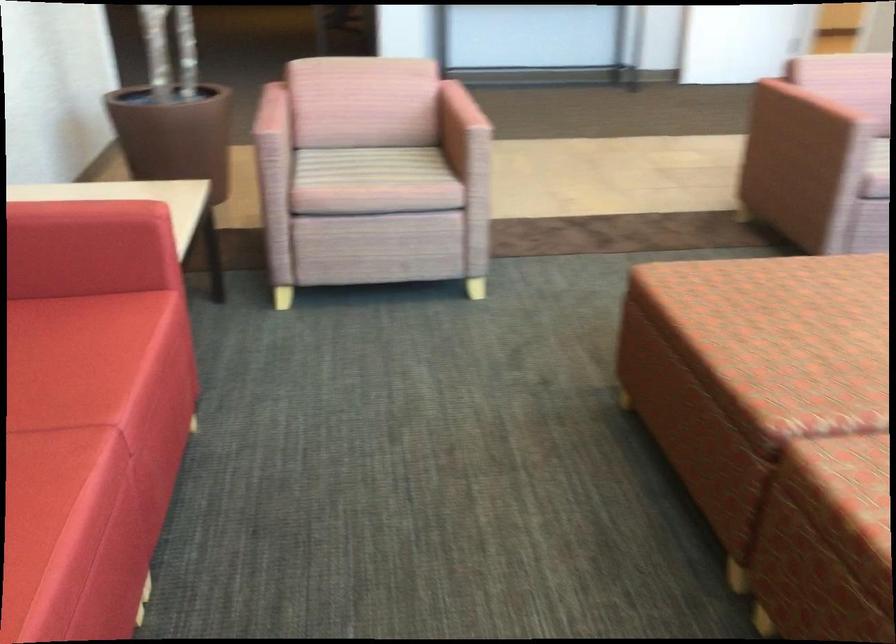
Locate an element on the screen. Image resolution: width=896 pixels, height=644 pixels. patterned sofa sitting surface is located at coordinates (805, 304).